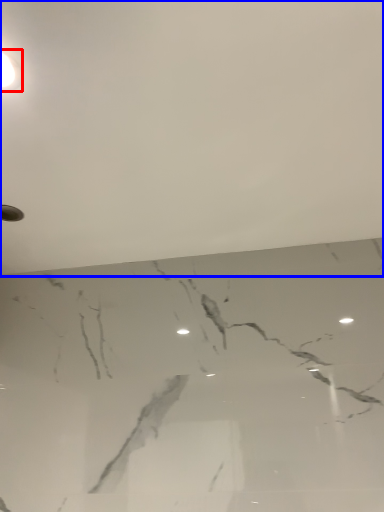
Question: Which of the following is the farthest to the observer, lamp (highlighted by a red box) or backdrop (highlighted by a blue box)?

Choices:
 (A) lamp
 (B) backdrop

Answer: (A)